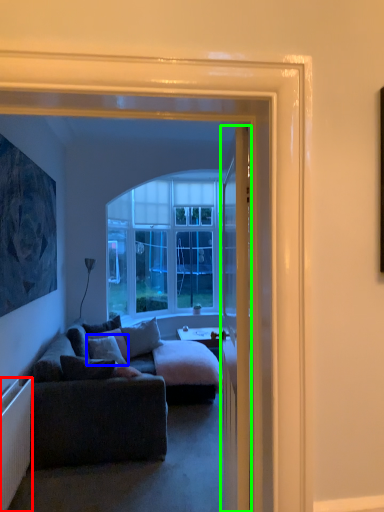
Question: Based on their relative distances, which object is farther from radiator (highlighted by a red box)? Choose from pillow (highlighted by a blue box) and door (highlighted by a green box).

Choices:
 (A) pillow
 (B) door

Answer: (A)